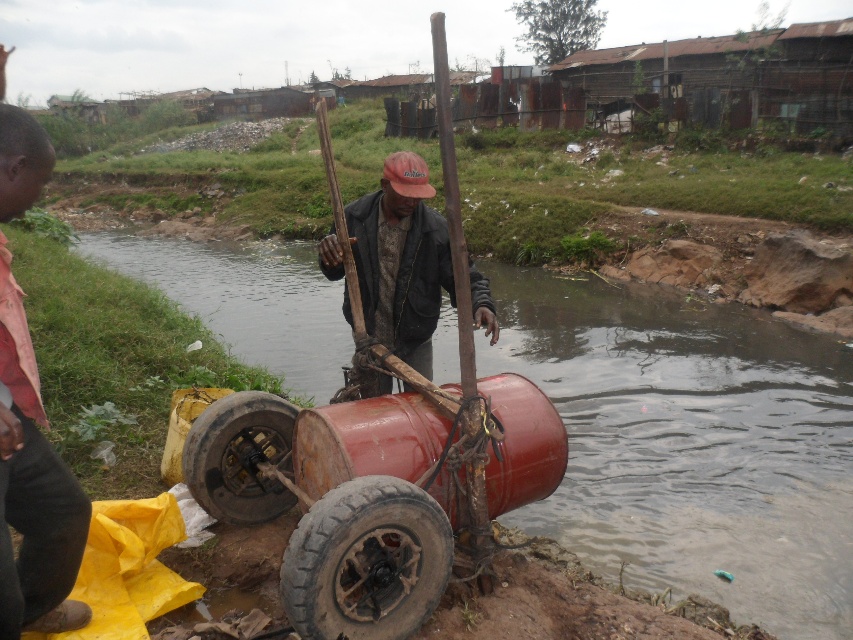
You are standing at the point with coordinates point (258,403) and want to walk to the point with coordinates point (422,253). Which direction should you move relative to your current position?

You should move backward because point (422,253) is behind point (258,403).

You are a hiker who wants to cross the rusty metallic river at center while avoiding getting your matte black jacket at center wet. Is there a way to cross the river without stepping into it?

The rusty metallic river at center is positioned over the matte black jacket at center, meaning the river is above the jacket. Therefore, you can safely cross the river by stepping on the elevated part where the river flows above, avoiding the area where the matte black jacket at center is located.

What is located at the coordinates point (689, 444) in the image?

The point (689, 444) indicates a rusty metallic river at center.